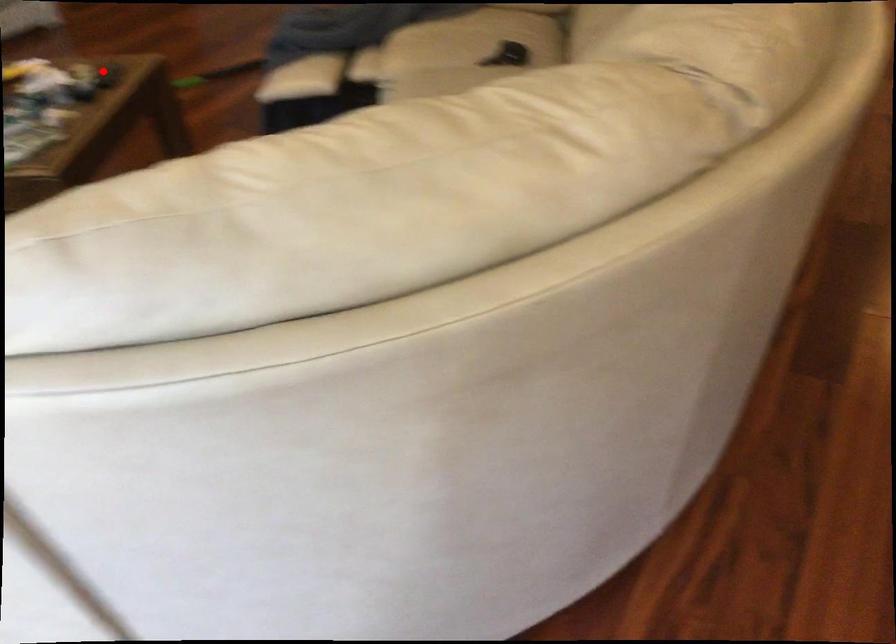
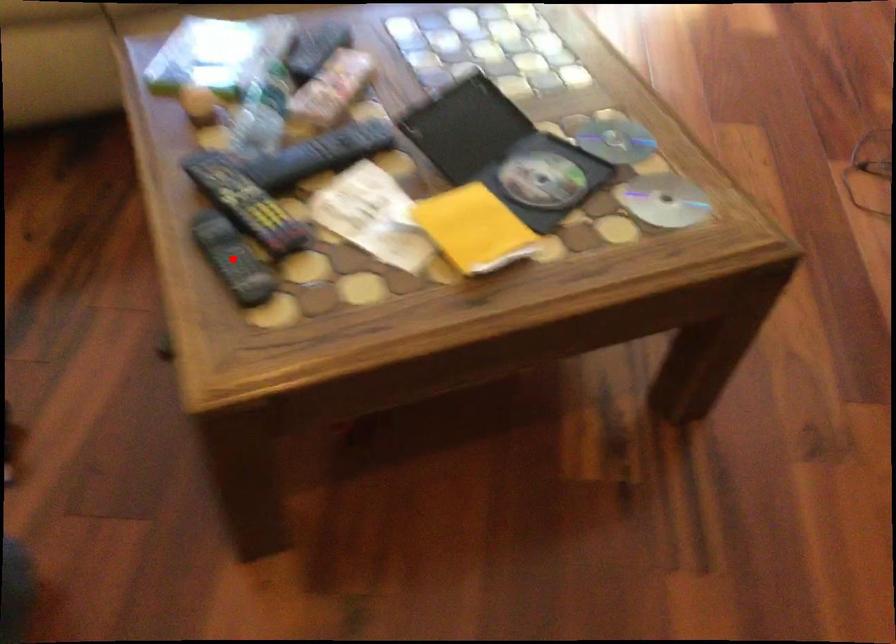
I am providing you with two images of the same scene from different viewpoints. A red point is marked on the first image and another point is marked on the second image. Is the red point in image1 aligned with the point shown in image2?

Yes